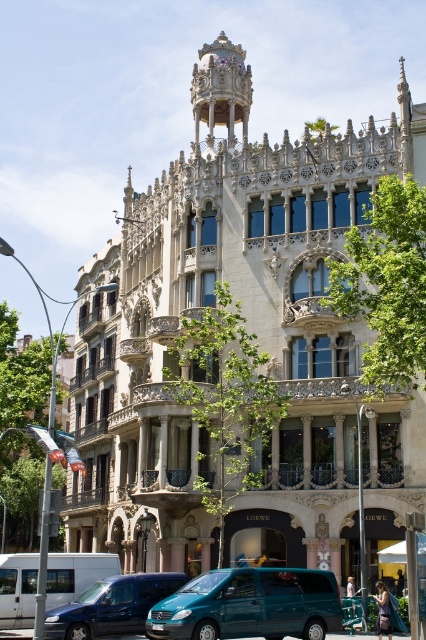
Question: Does teal matte van at center appear on the right side of teal matte van at lower left?

Choices:
 (A) yes
 (B) no

Answer: (A)

Question: Can you confirm if teal matte van at center is positioned to the left of teal matte van at lower left?

Choices:
 (A) no
 (B) yes

Answer: (A)

Question: Which point is farther to the camera?

Choices:
 (A) (203, 605)
 (B) (115, 609)

Answer: (B)

Question: Which of the following is the farthest from the observer?

Choices:
 (A) (51, 614)
 (B) (317, 600)

Answer: (A)

Question: Can you confirm if teal matte van at center is positioned to the right of teal matte van at lower left?

Choices:
 (A) yes
 (B) no

Answer: (A)